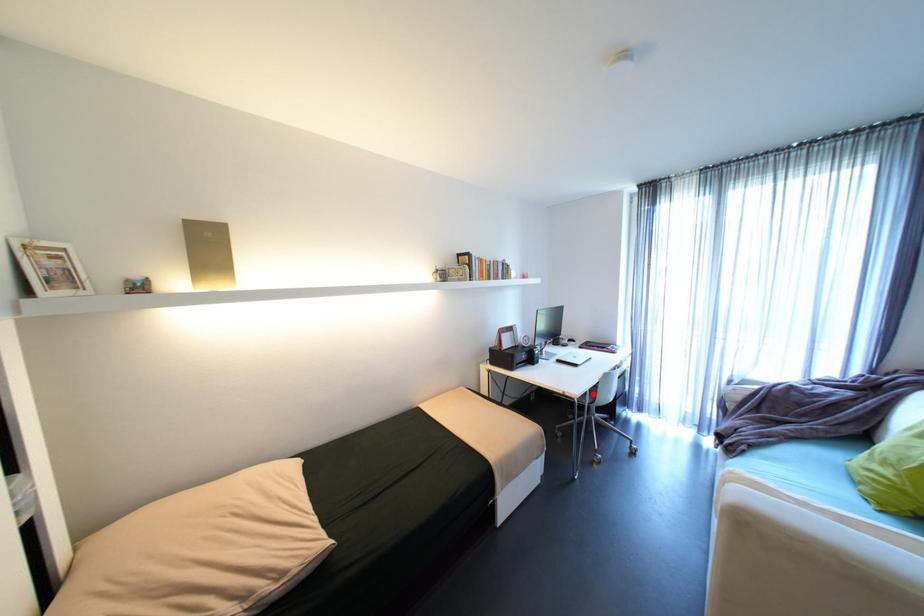
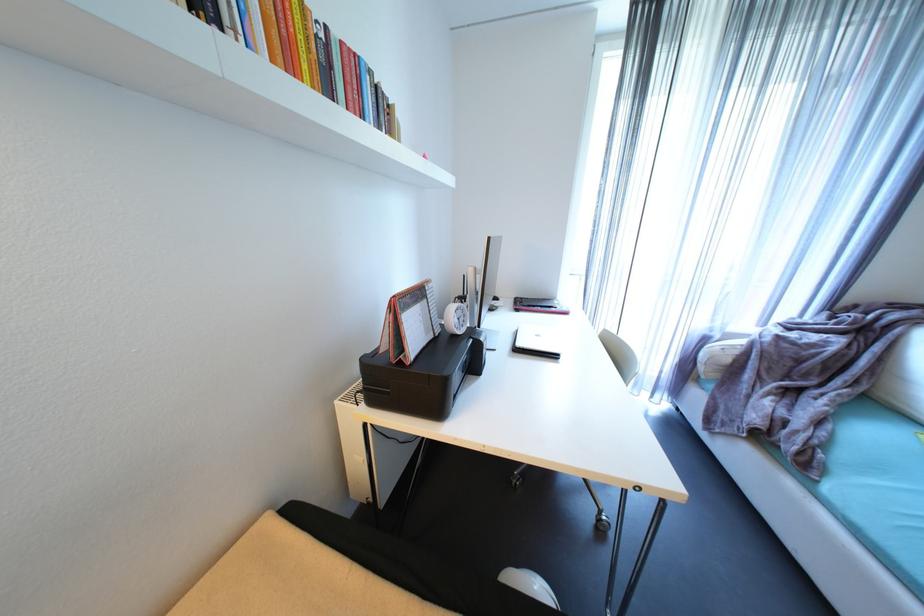
Question: I am providing you with two images of the same scene from different viewpoints. A red point is marked on the first image. At the location where the point appears in image 1, is it still visible in image 2?

Choices:
 (A) Yes
 (B) No

Answer: (B)